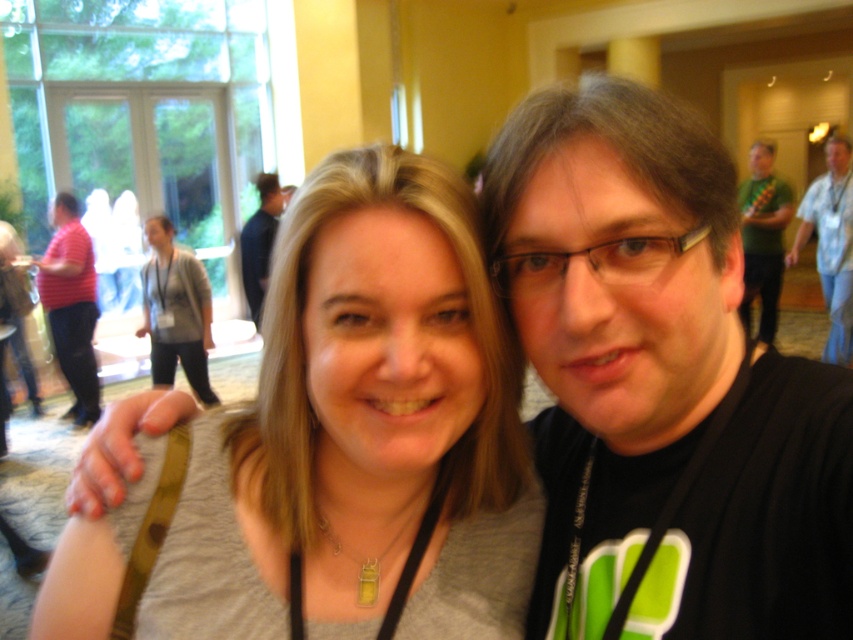
Question: Is gray fabric shirt at center to the left of green matte shirt at upper right from the viewer's perspective?

Choices:
 (A) no
 (B) yes

Answer: (B)

Question: Among these objects, which one is nearest to the camera?

Choices:
 (A) matte red shirt at left
 (B) green matte shirt at upper right
 (C) blue shirt at upper left
 (D) black matte shirt at center

Answer: (D)

Question: Based on their relative distances, which object is farther from the blue striped shirt at upper right?

Choices:
 (A) green matte shirt at upper right
 (B) black matte shirt at center
 (C) matte red shirt at left
 (D) gray fabric shirt at center

Answer: (D)

Question: In this image, where is black matte shirt at center located relative to blue striped shirt at upper right?

Choices:
 (A) below
 (B) above

Answer: (A)

Question: Which is farther from the blue shirt at upper left?

Choices:
 (A) green matte shirt at upper right
 (B) gray fabric shirt at center
 (C) blue striped shirt at upper right

Answer: (B)

Question: Does matte red shirt at left have a larger size compared to blue shirt at upper left?

Choices:
 (A) no
 (B) yes

Answer: (B)